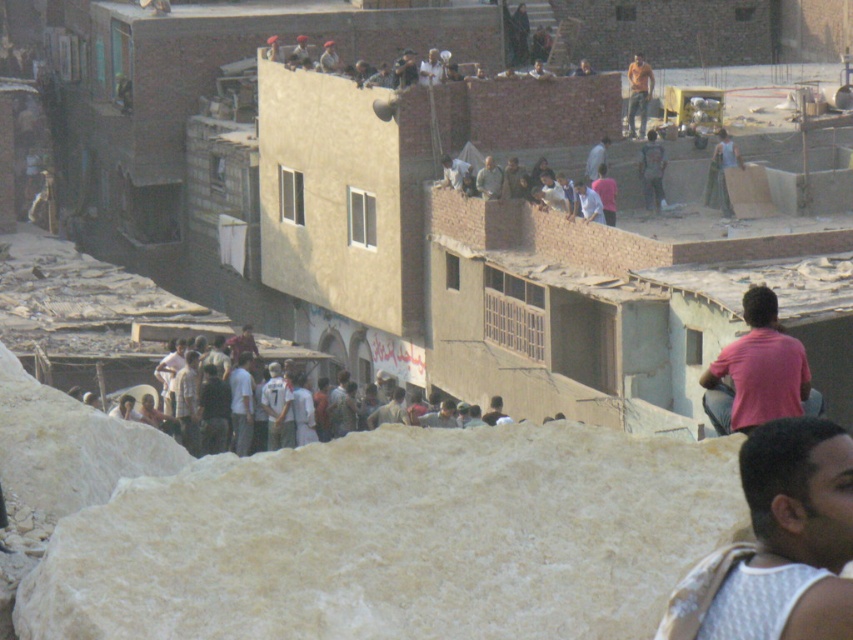
You are a fashion designer observing the urban scene. You notice two shirts in the crowd. The pink cotton shirt at right and the light brown fabric shirt at upper center. Which shirt would be more suitable for a design that requires a larger fabric area?

The pink cotton shirt at right has a larger size compared to the light brown fabric shirt at upper center, so it would be more suitable for a design requiring a larger fabric area.